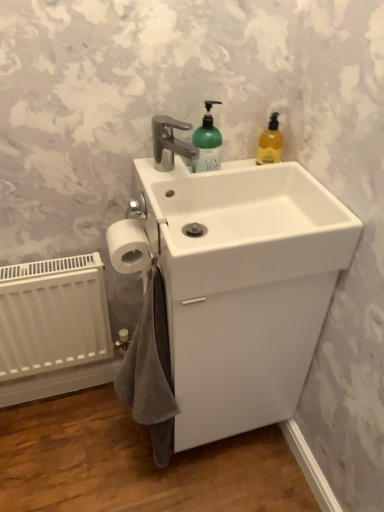
Question: Is white matte radiator at lower left at the back of white glossy sink at center?

Choices:
 (A) yes
 (B) no

Answer: (B)

Question: From the image's perspective, is white glossy sink at center beneath white matte radiator at lower left?

Choices:
 (A) yes
 (B) no

Answer: (B)

Question: Considering the relative sizes of white glossy sink at center and white matte radiator at lower left in the image provided, is white glossy sink at center shorter than white matte radiator at lower left?

Choices:
 (A) yes
 (B) no

Answer: (B)

Question: Considering the relative sizes of white glossy sink at center and white matte radiator at lower left in the image provided, is white glossy sink at center thinner than white matte radiator at lower left?

Choices:
 (A) yes
 (B) no

Answer: (B)

Question: From the image's perspective, is white glossy sink at center located above white matte radiator at lower left?

Choices:
 (A) no
 (B) yes

Answer: (B)

Question: From the image's perspective, is gray cotton bath towel at lower left located above or below white glossy sink at center?

Choices:
 (A) above
 (B) below

Answer: (B)

Question: Is point (165, 380) closer or farther from the camera than point (301, 185)?

Choices:
 (A) farther
 (B) closer

Answer: (B)

Question: Visually, is gray cotton bath towel at lower left positioned to the left or to the right of white glossy sink at center?

Choices:
 (A) left
 (B) right

Answer: (A)

Question: From a real-world perspective, relative to white glossy sink at center, is gray cotton bath towel at lower left vertically above or below?

Choices:
 (A) below
 (B) above

Answer: (A)

Question: In terms of height, does white glossy sink at center look taller or shorter compared to white glossy sink at center?

Choices:
 (A) short
 (B) tall

Answer: (A)

Question: Is white glossy sink at center to the left or to the right of white glossy sink at center in the image?

Choices:
 (A) right
 (B) left

Answer: (A)

Question: From a real-world perspective, is white glossy sink at center physically located above or below white glossy sink at center?

Choices:
 (A) below
 (B) above

Answer: (B)

Question: Based on their sizes in the image, would you say white glossy sink at center is bigger or smaller than white glossy sink at center?

Choices:
 (A) small
 (B) big

Answer: (A)

Question: Based on their positions, is gray cotton bath towel at lower left located to the left or right of white matte toilet paper at lower left?

Choices:
 (A) left
 (B) right

Answer: (B)

Question: Is point (148, 287) closer or farther from the camera than point (129, 222)?

Choices:
 (A) closer
 (B) farther

Answer: (A)